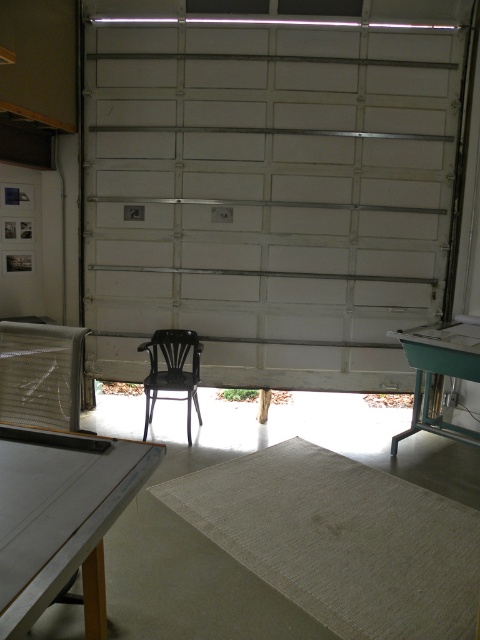
Question: Can you confirm if white glossy table at lower left is positioned to the left of green plastic table at right?

Choices:
 (A) no
 (B) yes

Answer: (B)

Question: Which point is farther to the camera?

Choices:
 (A) white glossy table at lower left
 (B) green plastic table at right

Answer: (B)

Question: Is metallic mesh chair at left positioned before green plastic table at right?

Choices:
 (A) no
 (B) yes

Answer: (B)

Question: Is white glossy table at lower left to the right of metallic mesh chair at left from the viewer's perspective?

Choices:
 (A) no
 (B) yes

Answer: (B)

Question: Which point is closer to the camera?

Choices:
 (A) (194, 339)
 (B) (34, 497)
 (C) (27, 404)

Answer: (B)

Question: Which object is the closest to the white glossy table at lower left?

Choices:
 (A) metallic black chair at center
 (B) metallic mesh chair at left
 (C) green plastic table at right

Answer: (B)